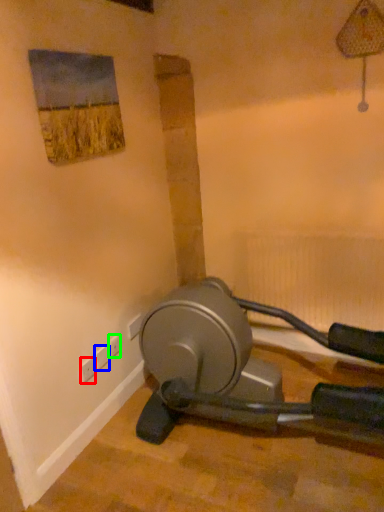
Question: Considering the real-world distances, which object is farthest from electric outlet (highlighted by a red box)? plug (highlighted by a blue box) or electric outlet (highlighted by a green box)?

Choices:
 (A) plug
 (B) electric outlet

Answer: (B)